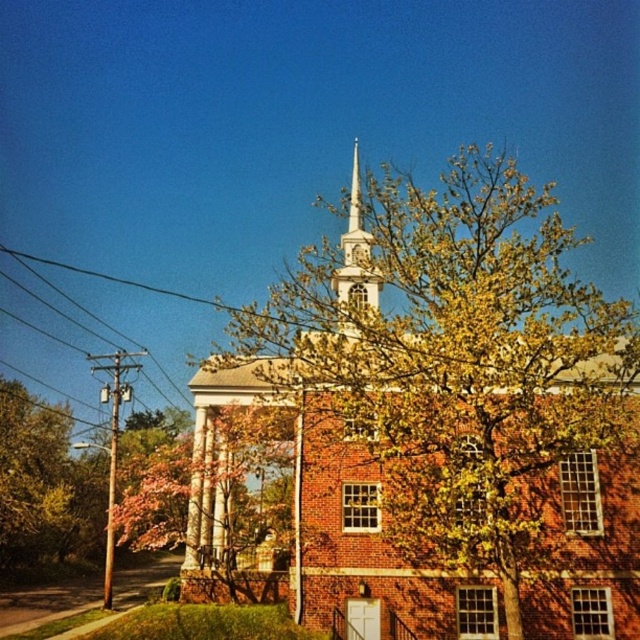
You are standing in front of the church and want to take a photo of the white steeple at the top without any obstructions. Which object from the green leafy tree at left and the black wire at left is less likely to block your view of the steeple?

The green leafy tree at left is not as tall as the black wire at left, so the tree is shorter. Therefore, the green leafy tree at left is less likely to block your view of the white steeple at the top compared to the black wire at left.

From the picture: You are standing in front of the church and want to take a photo of the white steeple at center without the green leafy tree at center blocking it. What should you do?

The green leafy tree at center is much taller than the white steeple at center, so you should move to a higher position to get a clear view of the white steeple at center without obstruction from the tree.